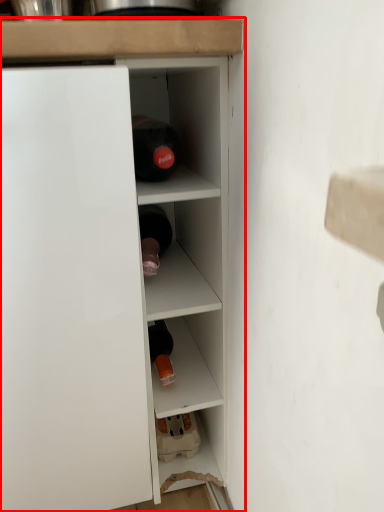
Question: From the image's perspective, where is cupboard (annotated by the red box) located relative to cabinet?

Choices:
 (A) above
 (B) below

Answer: (B)